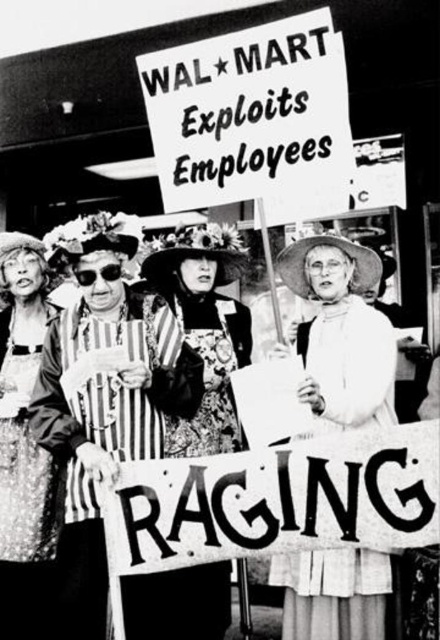
You are a photographer trying to capture a clear shot of both the white lace dress at center and the patterned fabric dress at center. Based on their positions, which dress should you focus on first to ensure both are in focus?

The white lace dress at center is in front of the patterned fabric dress at center. To ensure both are in focus, you should focus on the white lace dress at center first, as it is closer, and the depth of field will likely include the patterned fabric dress at center in the background.